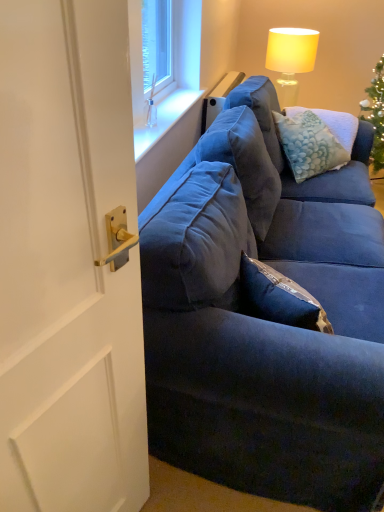
Question: Considering the relative positions of white glossy door handle at left and velvet blue couch at right in the image provided, is white glossy door handle at left to the left of velvet blue couch at right from the viewer's perspective?

Choices:
 (A) no
 (B) yes

Answer: (B)

Question: From the image's perspective, is white glossy door handle at left on velvet blue couch at right?

Choices:
 (A) yes
 (B) no

Answer: (B)

Question: Is white glossy door handle at left not inside velvet blue couch at right?

Choices:
 (A) yes
 (B) no

Answer: (A)

Question: From the image's perspective, is white glossy door handle at left beneath velvet blue couch at right?

Choices:
 (A) yes
 (B) no

Answer: (A)

Question: Is white glossy door handle at left touching velvet blue couch at right?

Choices:
 (A) no
 (B) yes

Answer: (A)

Question: Can you confirm if white glossy door handle at left is positioned to the right of velvet blue couch at right?

Choices:
 (A) no
 (B) yes

Answer: (A)

Question: Is velvety blue pillow at upper right closer to the viewer compared to clear glass vase at upper center?

Choices:
 (A) no
 (B) yes

Answer: (A)

Question: Is velvety blue pillow at upper right shorter than clear glass vase at upper center?

Choices:
 (A) no
 (B) yes

Answer: (A)

Question: Is velvety blue pillow at upper right next to clear glass vase at upper center and touching it?

Choices:
 (A) yes
 (B) no

Answer: (B)

Question: Is velvety blue pillow at upper right looking in the opposite direction of clear glass vase at upper center?

Choices:
 (A) yes
 (B) no

Answer: (B)

Question: Can you confirm if velvety blue pillow at upper right is wider than clear glass vase at upper center?

Choices:
 (A) yes
 (B) no

Answer: (A)

Question: From a real-world perspective, is velvety blue pillow at upper right on top of clear glass vase at upper center?

Choices:
 (A) no
 (B) yes

Answer: (A)

Question: Can you confirm if white glossy door handle at left is taller than velvety blue pillow at upper right?

Choices:
 (A) yes
 (B) no

Answer: (A)